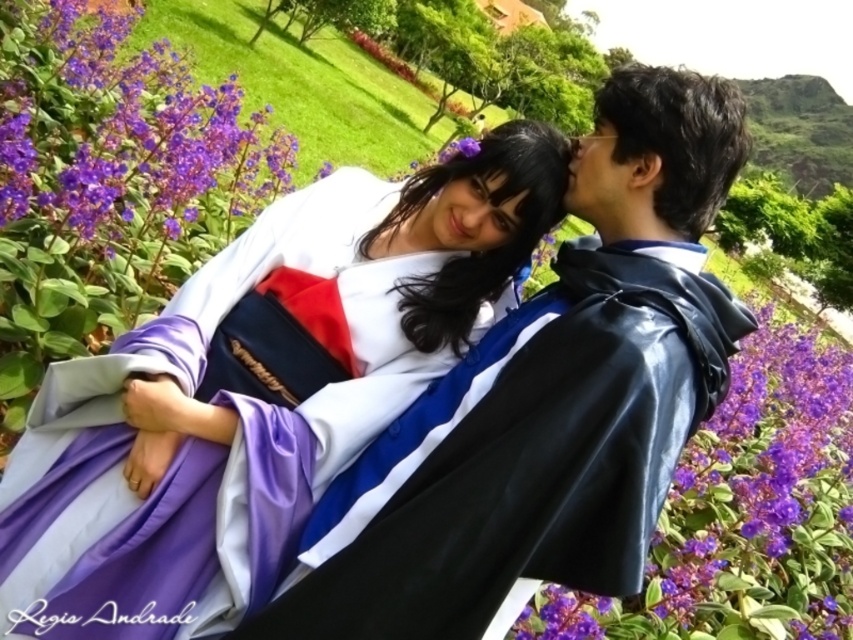
Question: Which point is closer to the camera taking this photo?

Choices:
 (A) (782, 394)
 (B) (184, 499)

Answer: (B)

Question: Where is satin white kimono at center located in relation to purple matte flowers at upper left in the image?

Choices:
 (A) above
 (B) below

Answer: (B)

Question: Estimate the real-world distances between objects in this image. Which object is farther from the satin white kimono at center?

Choices:
 (A) shiny black cape at center
 (B) purple matte flowers at upper left

Answer: (B)

Question: Among these points, which one is farthest from the camera?

Choices:
 (A) pyautogui.click(x=712, y=316)
 (B) pyautogui.click(x=204, y=468)
 (C) pyautogui.click(x=773, y=513)

Answer: (C)

Question: Is satin white kimono at center positioned behind purple matte flowers at upper left?

Choices:
 (A) yes
 (B) no

Answer: (B)

Question: Does satin white kimono at center have a lesser width compared to purple glossy flower at lower right?

Choices:
 (A) yes
 (B) no

Answer: (A)